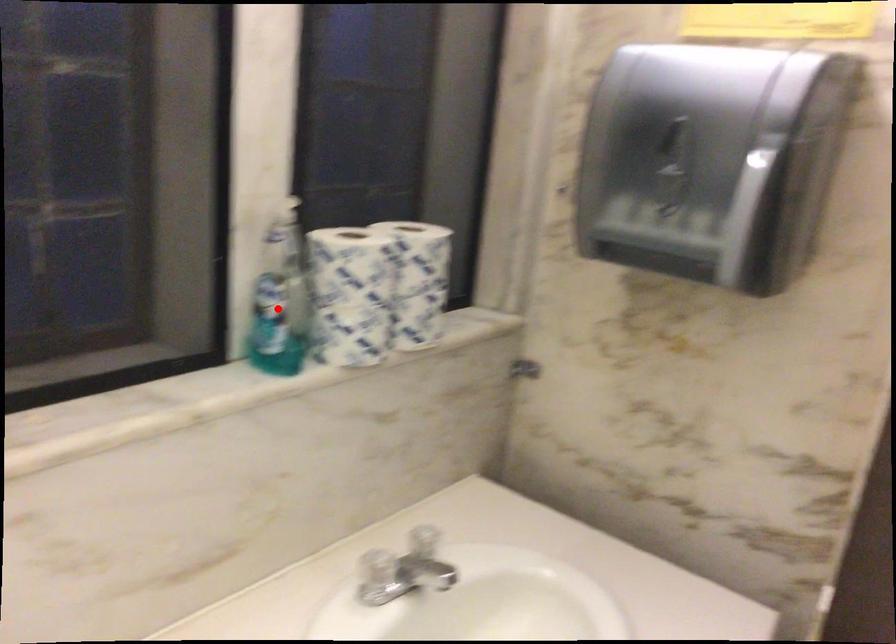
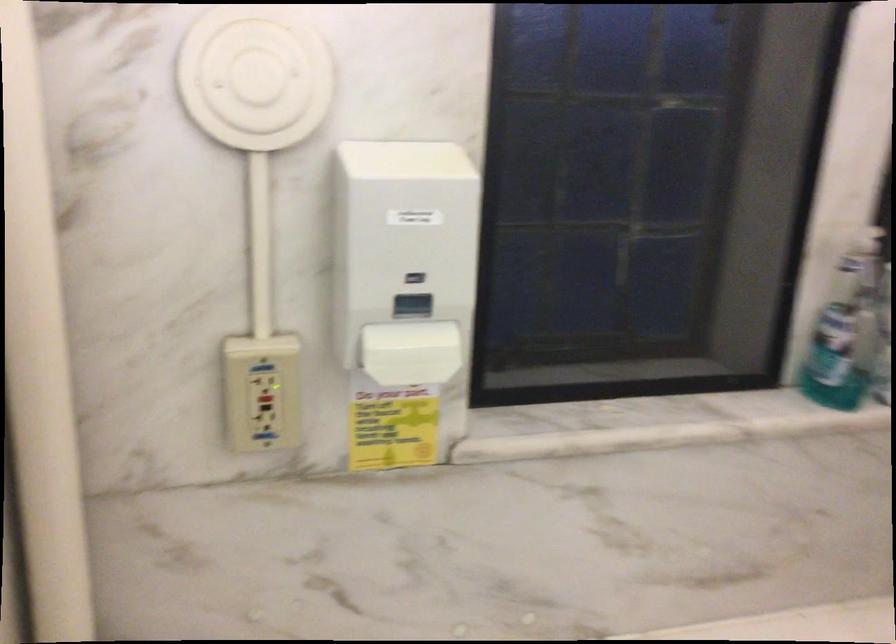
In the second image, find the point that corresponds to the highlighted location in the first image.

(842, 339)